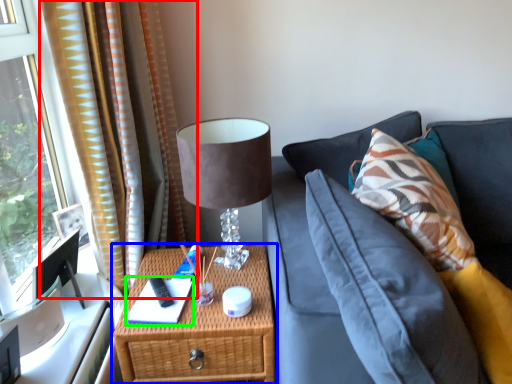
Question: Which object is the farthest from curtain (highlighted by a red box)? Choose among these: nightstand (highlighted by a blue box) or book (highlighted by a green box).

Choices:
 (A) nightstand
 (B) book

Answer: (B)